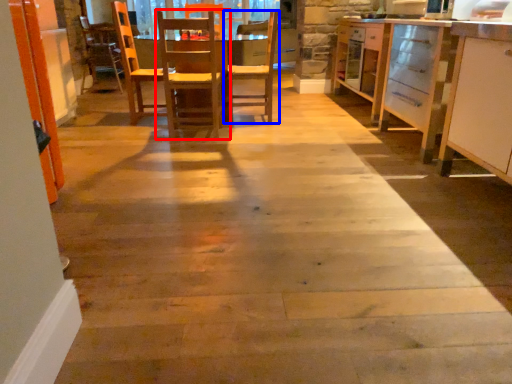
Question: Which point is closer to the camera, chair (highlighted by a red box) or chair (highlighted by a blue box)?

Choices:
 (A) chair
 (B) chair

Answer: (A)